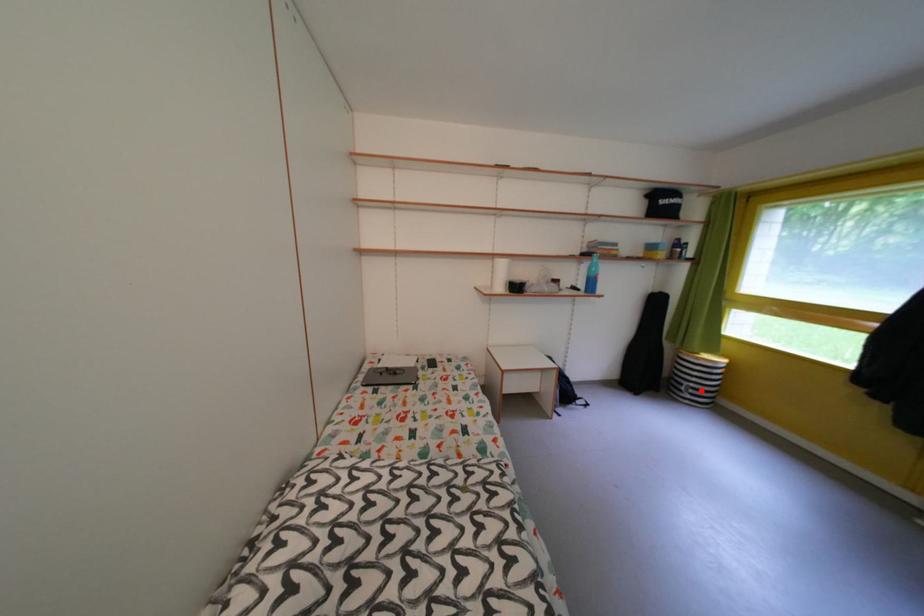
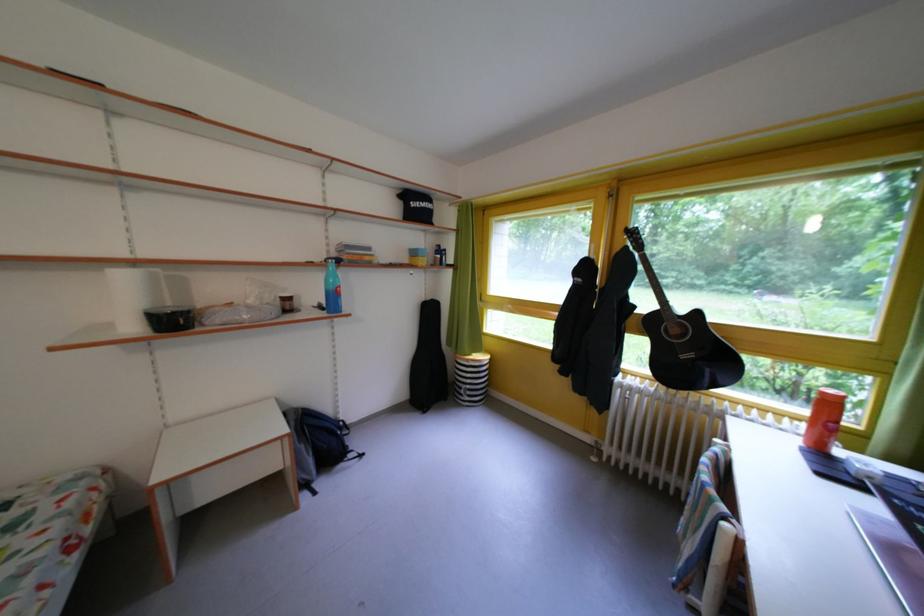
Question: I am providing you with two images of the same scene from different viewpoints. Image1 has a red point marked. In image2, the corresponding 3D location appears at what relative position? Reply with the corresponding letter.

Choices:
 (A) Closer
 (B) Farther

Answer: (B)